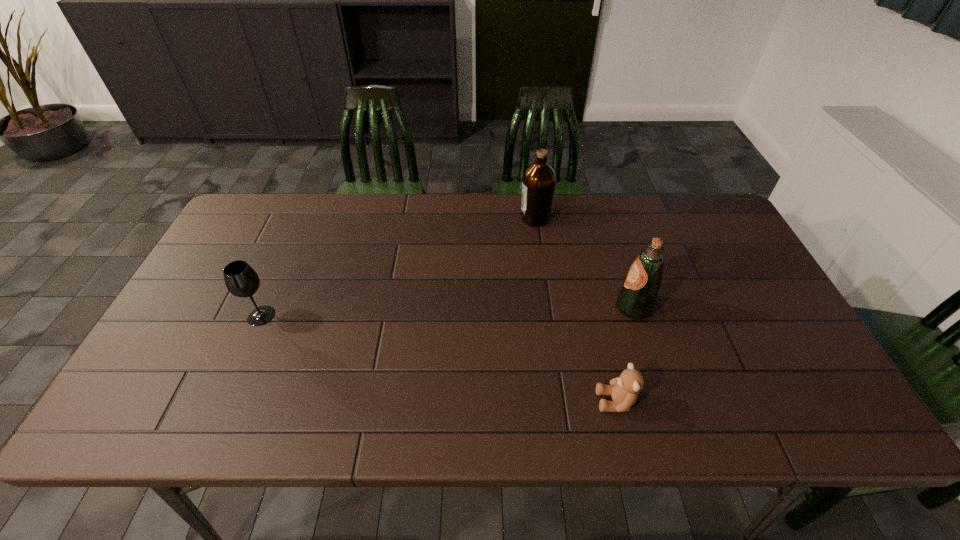
Where is `vacant space located 0.380m on the label of the farthest object`? vacant space located 0.380m on the label of the farthest object is located at coordinates (401, 218).

Image resolution: width=960 pixels, height=540 pixels. I want to click on free space located on the front-facing side of the rightmost object, so click(x=516, y=308).

I want to click on vacant area located on the front-facing side of the rightmost object, so click(x=588, y=308).

Image resolution: width=960 pixels, height=540 pixels. Find the location of `free point located on the front-facing side of the rightmost object`. free point located on the front-facing side of the rightmost object is located at coordinates (546, 308).

The height and width of the screenshot is (540, 960). I want to click on vacant space located on the back of the wineglass, so click(286, 258).

Find the location of a particular element. This screenshot has height=540, width=960. vacant space situated on the front-facing side of the second object from right to left is located at coordinates tap(484, 401).

Where is `vacant space situated 0.340m on the front-facing side of the second object from right to left`? The width and height of the screenshot is (960, 540). vacant space situated 0.340m on the front-facing side of the second object from right to left is located at coordinates (443, 401).

In order to click on vacant area situated on the front-facing side of the second object from right to left in this screenshot , I will do `click(479, 401)`.

Identify the location of object that is at the far edge. Image resolution: width=960 pixels, height=540 pixels. (539, 179).

Find the location of `object located at the near edge`. object located at the near edge is located at coordinates (624, 390).